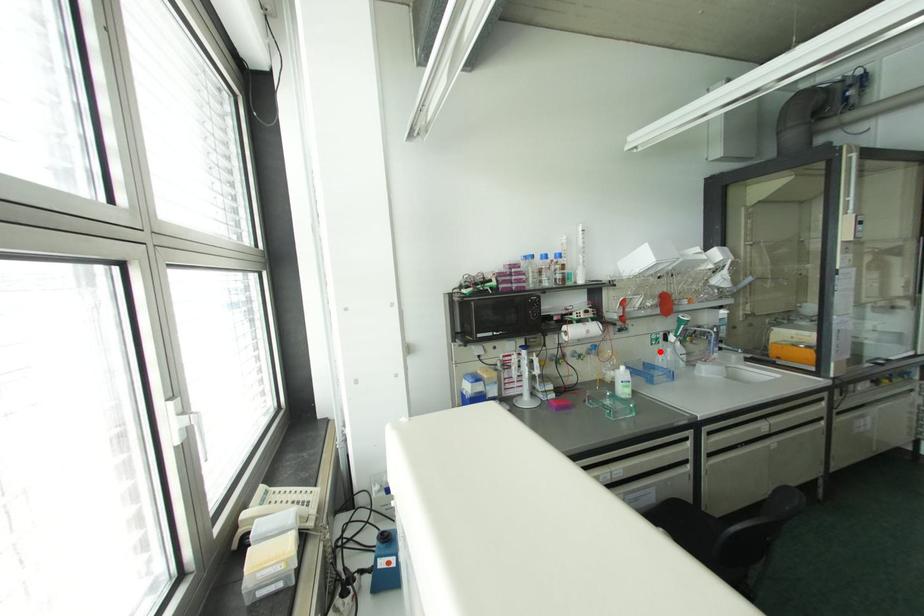
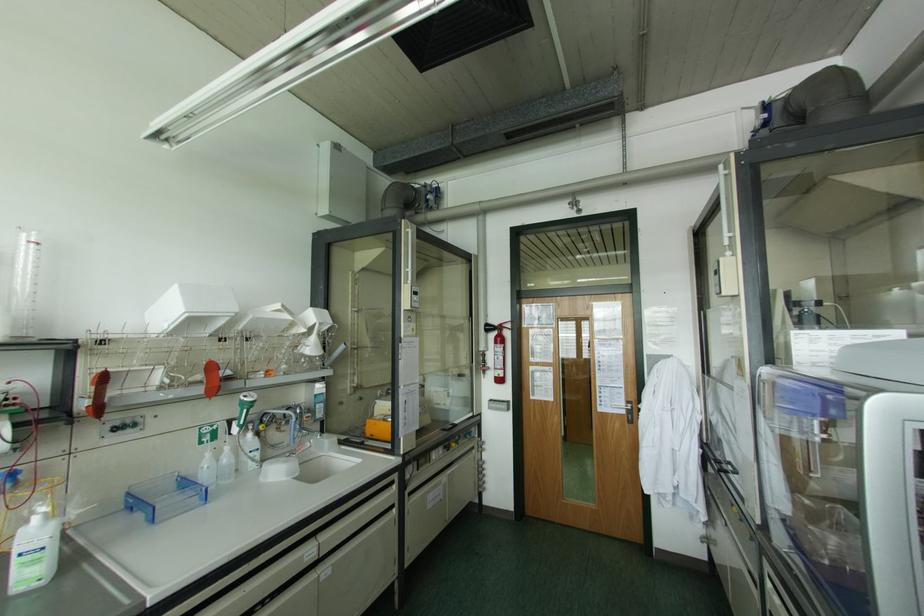
In the second image, find the point that corresponds to the highlighted location in the first image.

(208, 454)